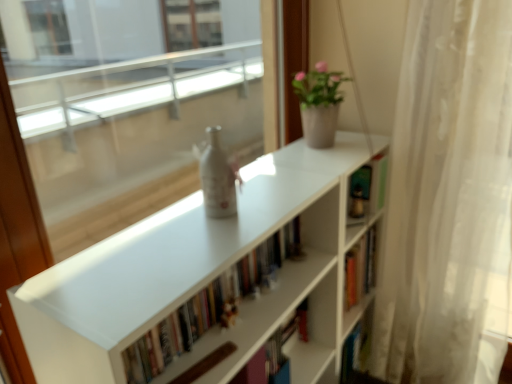
Describe the element at coordinates (205, 275) in the screenshot. I see `white matte bookcase at center` at that location.

What do you see at coordinates (319, 103) in the screenshot? This screenshot has width=512, height=384. I see `matte white pot at upper right` at bounding box center [319, 103].

You are a GUI agent. You are given a task and a screenshot of the screen. Output one action in this format:
    pyautogui.click(x=<x>, y=<y>)
    Task: Click on the white matte bookcase at center
    This screenshot has height=384, width=512.
    Given the screenshot: What is the action you would take?
    pyautogui.click(x=205, y=275)

From a real-world perspective, which object stands above the other?

white matte bookshelf at center is physically above.

Between white matte bookshelf at center and white sheer curtain at right, which one is positioned behind?

Positioned behind is white sheer curtain at right.

Is white matte bookshelf at center touching white sheer curtain at right?

There is a gap between white matte bookshelf at center and white sheer curtain at right.

Is point (426, 300) closer to camera compared to point (39, 305)?

No, (426, 300) is behind (39, 305).

From a real-world perspective, between white sheer curtain at right and white matte bookcase at center, who is vertically lower?

white matte bookcase at center is physically lower.

Considering the positions of objects white sheer curtain at right and white matte bookcase at center in the image provided, who is more to the left, white sheer curtain at right or white matte bookcase at center?

Positioned to the left is white matte bookcase at center.

At what (x,y) coordinates should I click in order to perform the action: click on book located above the white matte bookcase at center (from a real-world perspective). Please return your answer as a coordinate pair (x, y). Image resolution: width=512 pixels, height=384 pixels. Looking at the image, I should click on (208, 306).

Looking at their sizes, would you say white matte bookshelf at center is wider or thinner than white matte bookcase at center?

In the image, white matte bookshelf at center appears to be more narrow than white matte bookcase at center.

From a real-world perspective, who is located lower, white matte bookshelf at center or white matte bookcase at center?

white matte bookcase at center.

Based on the photo, considering the sizes of objects white matte bookshelf at center and white matte bookcase at center in the image provided, who is smaller, white matte bookshelf at center or white matte bookcase at center?

white matte bookshelf at center is smaller.

Between white matte bookcase at center and white matte bookshelf at center, which one appears on the right side from the viewer's perspective?

Positioned to the right is white matte bookcase at center.

Between point (268, 174) and point (264, 259), which one is positioned in front?

Positioned in front is point (264, 259).

Looking at this image, how different are the orientations of white matte bookcase at center and white matte bookshelf at center in degrees?

2.06 degrees.

Measure the distance between white matte bookcase at center and white matte bookshelf at center.

The distance of white matte bookcase at center from white matte bookshelf at center is 5.02 inches.

Can you tell me how much white sheer curtain at right and matte white pot at upper right differ in facing direction?

There is a 90.6-degree angle between the facing directions of white sheer curtain at right and matte white pot at upper right.

Locate an element on the screen. curtain beneath the matte white pot at upper right (from a real-world perspective) is located at coordinates (449, 199).

Do you think white sheer curtain at right is within matte white pot at upper right, or outside of it?

white sheer curtain at right is outside matte white pot at upper right.

Can you confirm if white sheer curtain at right is wider than matte white pot at upper right?

Indeed, white sheer curtain at right has a greater width compared to matte white pot at upper right.

Does white matte bookshelf at center have a greater width compared to matte white pot at upper right?

In fact, white matte bookshelf at center might be narrower than matte white pot at upper right.

From a real-world perspective, is white matte bookshelf at center under matte white pot at upper right?

Yes, from a real-world perspective, white matte bookshelf at center is beneath matte white pot at upper right.

Locate an element on the screen. houseplant above the white matte bookshelf at center (from the image's perspective) is located at coordinates (319, 103).

From the picture: Considering the relative positions of white sheer curtain at right and white matte bookshelf at center in the image provided, is white sheer curtain at right behind white matte bookshelf at center?

Yes, white sheer curtain at right is further from the camera.

Does white sheer curtain at right appear on the right side of white matte bookshelf at center?

Yes, white sheer curtain at right is to the right of white matte bookshelf at center.

Considering the relative sizes of white sheer curtain at right and white matte bookshelf at center in the image provided, is white sheer curtain at right thinner than white matte bookshelf at center?

No.

Considering the positions of points (395, 341) and (140, 349), is point (395, 341) farther from camera compared to point (140, 349)?

Yes, point (395, 341) is farther from viewer.

Find the location of a particular element. This screenshot has height=384, width=512. book below the white sheer curtain at right (from the image's perspective) is located at coordinates (208, 306).

At what (x,y) coordinates should I click in order to perform the action: click on bookcase that is under the white sheer curtain at right (from a real-world perspective). Please return your answer as a coordinate pair (x, y). This screenshot has height=384, width=512. Looking at the image, I should click on (205, 275).

Which object lies nearer to the anchor point matte white pot at upper right, white matte bookshelf at center or white matte bookcase at center?

Among the two, white matte bookcase at center is located nearer to matte white pot at upper right.

Considering their positions, is matte white pot at upper right positioned further to white matte bookshelf at center than white sheer curtain at right?

white sheer curtain at right is positioned further to the anchor white matte bookshelf at center.

Which object lies further to the anchor point white matte bookshelf at center, white matte bookcase at center or matte white pot at upper right?

matte white pot at upper right is further to white matte bookshelf at center.

From the image, which object appears to be farther from white sheer curtain at right, white matte bookshelf at center or white matte bookcase at center?

white matte bookshelf at center is positioned further to the anchor white sheer curtain at right.

Which object lies nearer to the anchor point white matte bookcase at center, white matte bookshelf at center or white sheer curtain at right?

white matte bookshelf at center is positioned closer to the anchor white matte bookcase at center.

Based on their spatial positions, is white sheer curtain at right or white matte bookcase at center closer to matte white pot at upper right?

Among the two, white matte bookcase at center is located nearer to matte white pot at upper right.

Based on the photo, based on their spatial positions, is white sheer curtain at right or white matte bookcase at center further from white matte bookshelf at center?

Among the two, white sheer curtain at right is located further to white matte bookshelf at center.

Considering their positions, is white matte bookcase at center positioned further to white sheer curtain at right than white matte bookshelf at center?

The object further to white sheer curtain at right is white matte bookshelf at center.

Locate an element on the screen. The width and height of the screenshot is (512, 384). curtain between matte white pot at upper right and white matte bookcase at center in the up-down direction is located at coordinates (449, 199).

Image resolution: width=512 pixels, height=384 pixels. What are the coordinates of `book between matte white pot at upper right and white matte bookcase at center in the vertical direction` in the screenshot? It's located at (208, 306).

At what (x,y) coordinates should I click in order to perform the action: click on houseplant located between white matte bookshelf at center and white sheer curtain at right in the left-right direction. Please return your answer as a coordinate pair (x, y). The image size is (512, 384). Looking at the image, I should click on (319, 103).

Where is `bookcase located between white matte bookshelf at center and white sheer curtain at right in the left-right direction`? The image size is (512, 384). bookcase located between white matte bookshelf at center and white sheer curtain at right in the left-right direction is located at coordinates (205, 275).